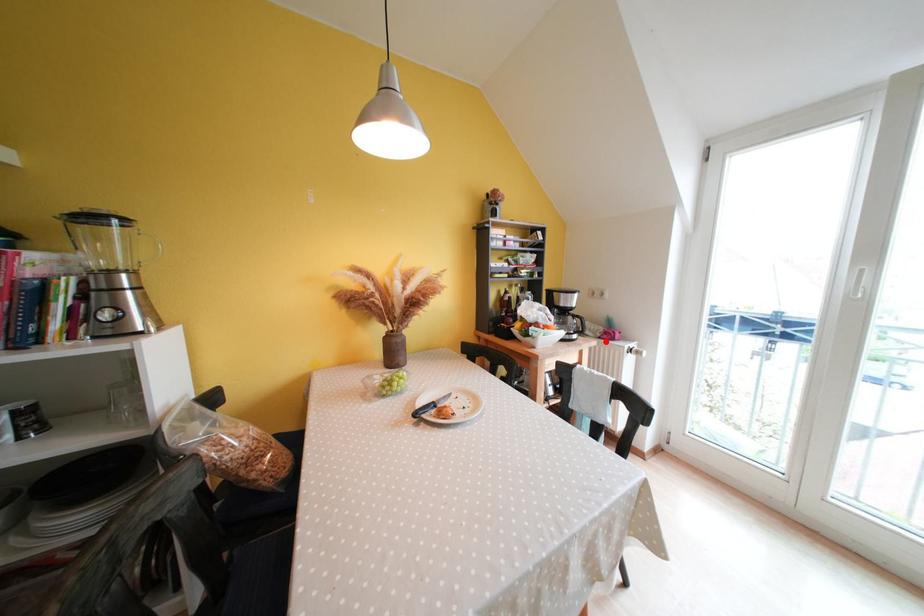
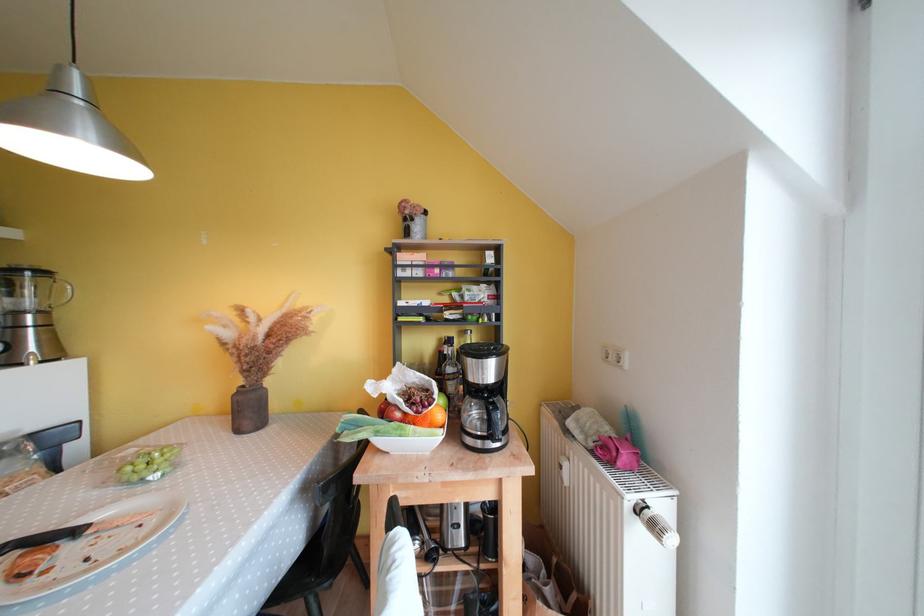
Find the pixel in the second image that matches the highlighted location in the first image.

(599, 456)